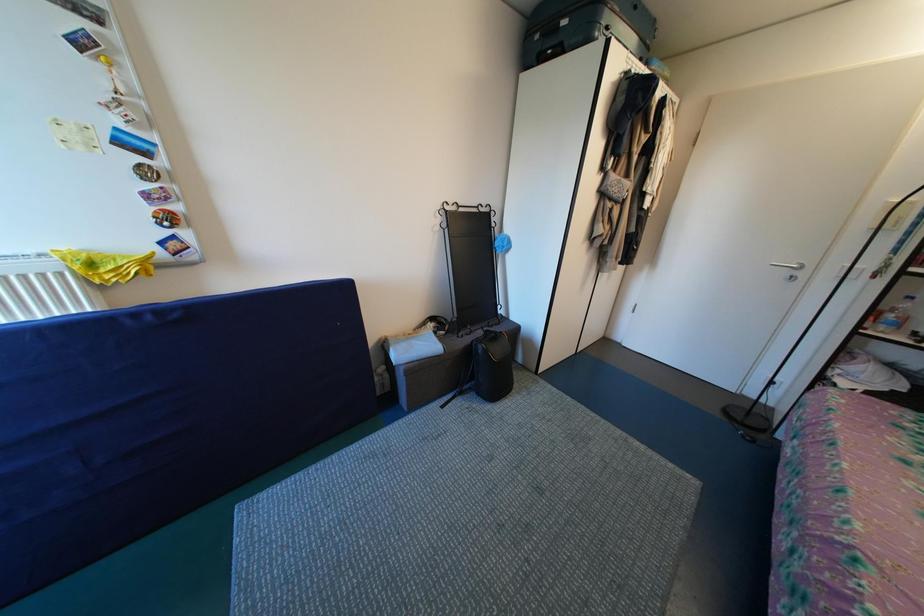
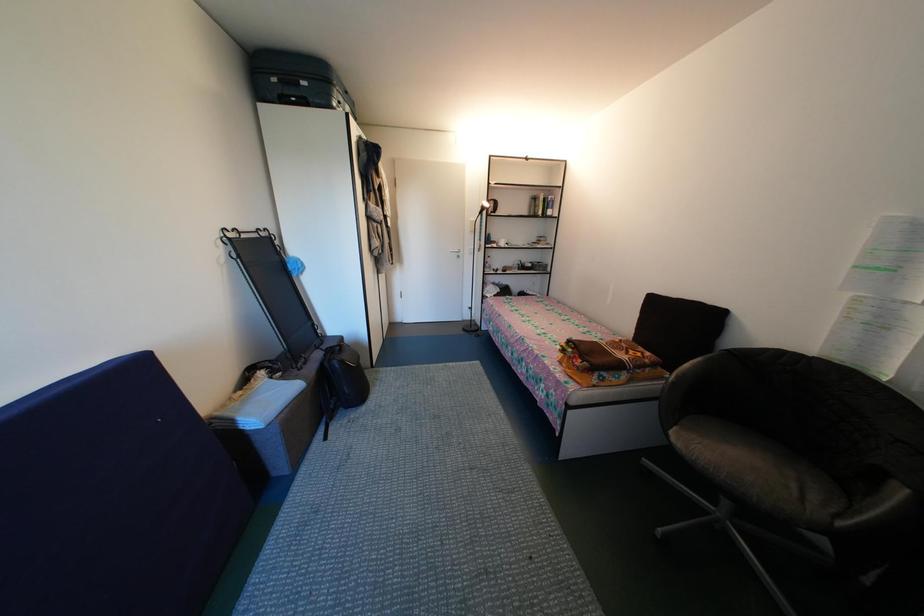
Question: Based on the continuous images, in which direction is the camera rotating? Reply with the corresponding letter.

Choices:
 (A) Left
 (B) Right
 (C) Up
 (D) Down

Answer: (B)